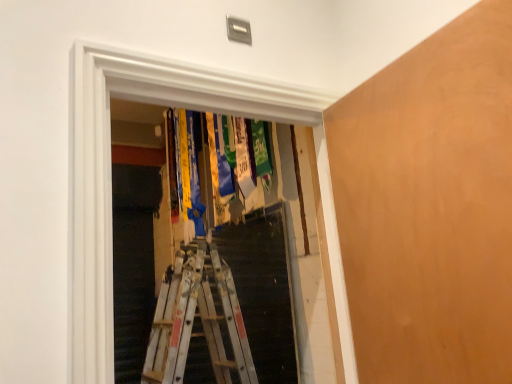
Identify the location of transparent plastic medals at center. This screenshot has width=512, height=384. (110, 177).

I want to click on smooth orange plywood at right, so click(430, 206).

Is smooth orange plywood at right smaller than transparent plastic medals at center?

Yes.

From a real-world perspective, is smooth orange plywood at right located higher than transparent plastic medals at center?

No, from a real-world perspective, smooth orange plywood at right is not over transparent plastic medals at center

Is smooth orange plywood at right positioned with its back to transparent plastic medals at center?

No.

Identify the location of plywood above the transparent plastic medals at center (from the image's perspective). This screenshot has height=384, width=512. (430, 206).

Is smooth orange plywood at right thinner than metallic silver ladder at center?

In fact, smooth orange plywood at right might be wider than metallic silver ladder at center.

Considering the relative sizes of smooth orange plywood at right and metallic silver ladder at center in the image provided, is smooth orange plywood at right bigger than metallic silver ladder at center?

No.

Are smooth orange plywood at right and metallic silver ladder at center far apart?

smooth orange plywood at right is positioned a significant distance from metallic silver ladder at center.

Who is shorter, smooth orange plywood at right or metallic silver ladder at center?

Standing shorter between the two is smooth orange plywood at right.

In the image, is metallic silver ladder at center on the left side or the right side of smooth orange plywood at right?

In the image, metallic silver ladder at center appears on the left side of smooth orange plywood at right.

Does metallic silver ladder at center have a larger size compared to smooth orange plywood at right?

Indeed, metallic silver ladder at center has a larger size compared to smooth orange plywood at right.

Based on the photo, how many degrees apart are the facing directions of metallic silver ladder at center and smooth orange plywood at right?

They differ by 5.28 degrees in their facing directions.

From a real-world perspective, who is located lower, transparent plastic medals at center or smooth orange plywood at right?

smooth orange plywood at right, from a real-world perspective.

Does transparent plastic medals at center touch smooth orange plywood at right?

No.

Locate an element on the screen. window on the left of smooth orange plywood at right is located at coordinates (110, 177).

Does transparent plastic medals at center have a lesser width compared to smooth orange plywood at right?

No, transparent plastic medals at center is not thinner than smooth orange plywood at right.

Considering the sizes of transparent plastic medals at center and metallic silver ladder at center in the image, is transparent plastic medals at center taller or shorter than metallic silver ladder at center?

Clearly, transparent plastic medals at center is taller compared to metallic silver ladder at center.

Visually, is transparent plastic medals at center positioned to the left or to the right of metallic silver ladder at center?

From the image, it's evident that transparent plastic medals at center is to the right of metallic silver ladder at center.

Considering the sizes of transparent plastic medals at center and metallic silver ladder at center in the image, is transparent plastic medals at center wider or thinner than metallic silver ladder at center?

Clearly, transparent plastic medals at center has more width compared to metallic silver ladder at center.

From the image's perspective, would you say transparent plastic medals at center is shown under metallic silver ladder at center?

No, from the image's perspective, transparent plastic medals at center is not beneath metallic silver ladder at center.

The height and width of the screenshot is (384, 512). What are the coordinates of `window in front of the metallic silver ladder at center` in the screenshot? It's located at (110, 177).

Is metallic silver ladder at center next to transparent plastic medals at center and touching it?

No, metallic silver ladder at center is not making contact with transparent plastic medals at center.

Would you say metallic silver ladder at center is inside or outside transparent plastic medals at center?

metallic silver ladder at center is spatially situated outside transparent plastic medals at center.

Which object is positioned more to the right, metallic silver ladder at center or transparent plastic medals at center?

Positioned to the right is transparent plastic medals at center.

Locate an element on the screen. window above the smooth orange plywood at right (from a real-world perspective) is located at coordinates (110, 177).

This screenshot has width=512, height=384. Identify the location of plywood that appears in front of the metallic silver ladder at center. (430, 206).

Considering their positions, is smooth orange plywood at right positioned closer to transparent plastic medals at center than metallic silver ladder at center?

The object closer to transparent plastic medals at center is smooth orange plywood at right.

Based on their spatial positions, is transparent plastic medals at center or metallic silver ladder at center closer to smooth orange plywood at right?

transparent plastic medals at center lies closer to smooth orange plywood at right than the other object.

Looking at the image, which one is located further to metallic silver ladder at center, smooth orange plywood at right or transparent plastic medals at center?

transparent plastic medals at center lies further to metallic silver ladder at center than the other object.

Which object lies further to the anchor point smooth orange plywood at right, metallic silver ladder at center or transparent plastic medals at center?

metallic silver ladder at center lies further to smooth orange plywood at right than the other object.

Based on their spatial positions, is metallic silver ladder at center or smooth orange plywood at right closer to transparent plastic medals at center?

Among the two, smooth orange plywood at right is located nearer to transparent plastic medals at center.

Considering their positions, is transparent plastic medals at center positioned closer to metallic silver ladder at center than smooth orange plywood at right?

smooth orange plywood at right lies closer to metallic silver ladder at center than the other object.

The height and width of the screenshot is (384, 512). Find the location of `window between smooth orange plywood at right and metallic silver ladder at center in the front-back direction`. window between smooth orange plywood at right and metallic silver ladder at center in the front-back direction is located at coordinates (110, 177).